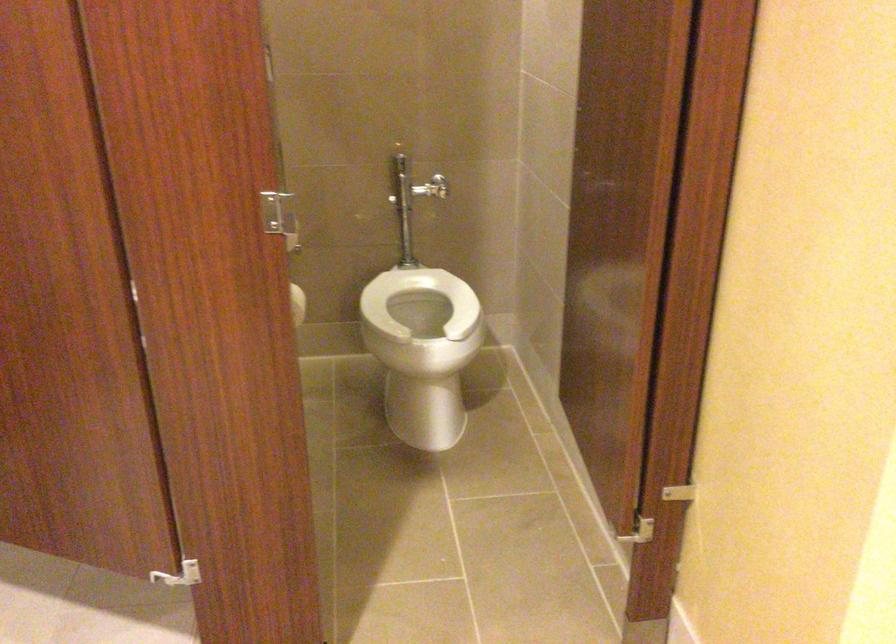
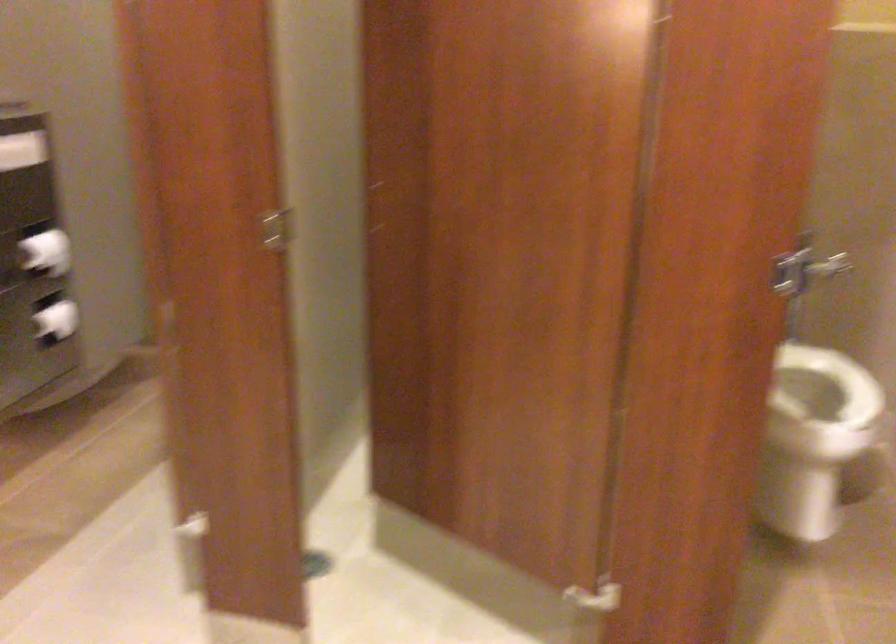
In the second image, find the point that corresponds to (421,324) in the first image.

(811, 393)